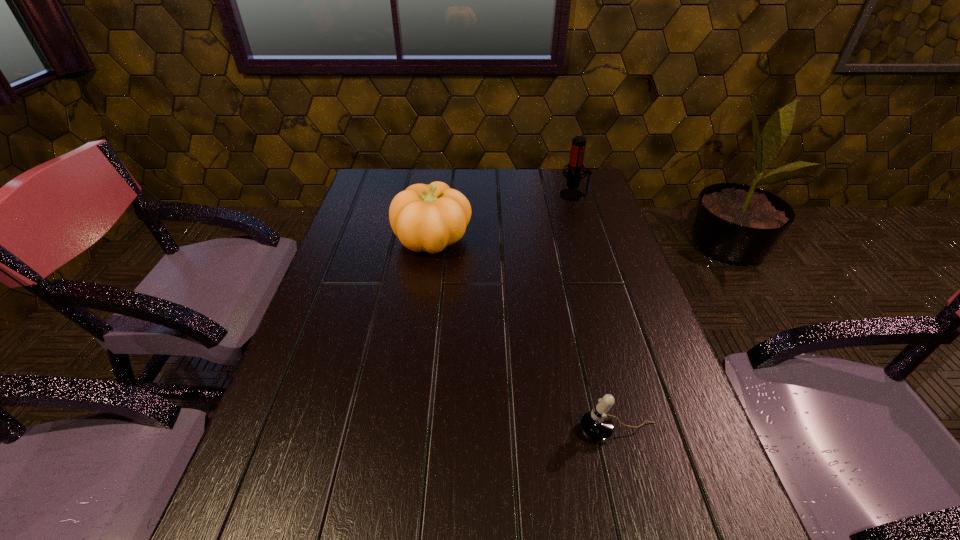
This screenshot has width=960, height=540. I want to click on free space between the pumpkin and the taller microphone, so click(503, 217).

Where is `free space between the shorter microphone and the farther microphone`? free space between the shorter microphone and the farther microphone is located at coordinates (596, 313).

Where is `free point between the nearest object and the farther microphone`? This screenshot has height=540, width=960. free point between the nearest object and the farther microphone is located at coordinates (596, 313).

The height and width of the screenshot is (540, 960). I want to click on empty location between the nearest object and the second nearest object, so click(525, 335).

You are a GUI agent. You are given a task and a screenshot of the screen. Output one action in this format:
    pyautogui.click(x=<x>, y=<y>)
    Task: Click on the empty location between the second farthest object and the nearer microphone
    
    Given the screenshot: What is the action you would take?
    pyautogui.click(x=525, y=335)

The height and width of the screenshot is (540, 960). Identify the location of vacant space that is in between the second farthest object and the shortest object. (525, 335).

Choose which object is the second nearest neighbor to the shorter microphone. Please provide its 2D coordinates. Your answer should be formatted as a tuple, i.e. [(x, y)], where the tuple contains the x and y coordinates of a point satisfying the conditions above.

[(575, 166)]

The height and width of the screenshot is (540, 960). Identify the location of object that can be found as the closest to the taller microphone. (429, 218).